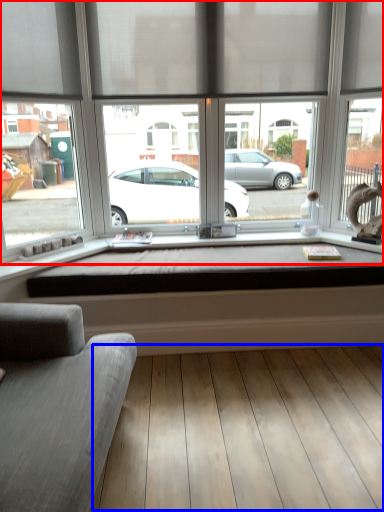
Question: Which point is further to the camera, window (highlighted by a red box) or plank (highlighted by a blue box)?

Choices:
 (A) window
 (B) plank

Answer: (A)